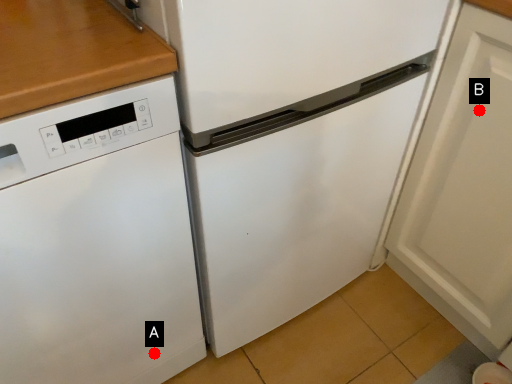
Question: Two points are circled on the image, labeled by A and B beside each circle. Which point is farther from the camera taking this photo?

Choices:
 (A) A is further
 (B) B is further

Answer: (A)